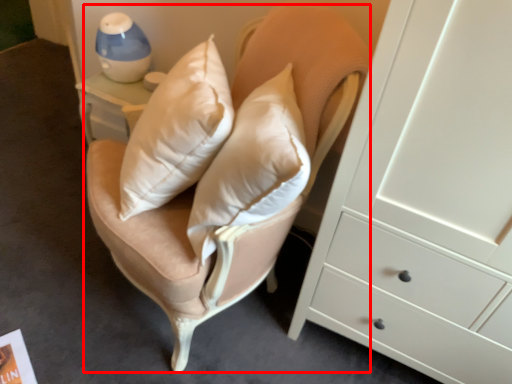
Question: From the image's perspective, where is swivel chair (annotated by the red box) located relative to table lamp?

Choices:
 (A) below
 (B) above

Answer: (A)